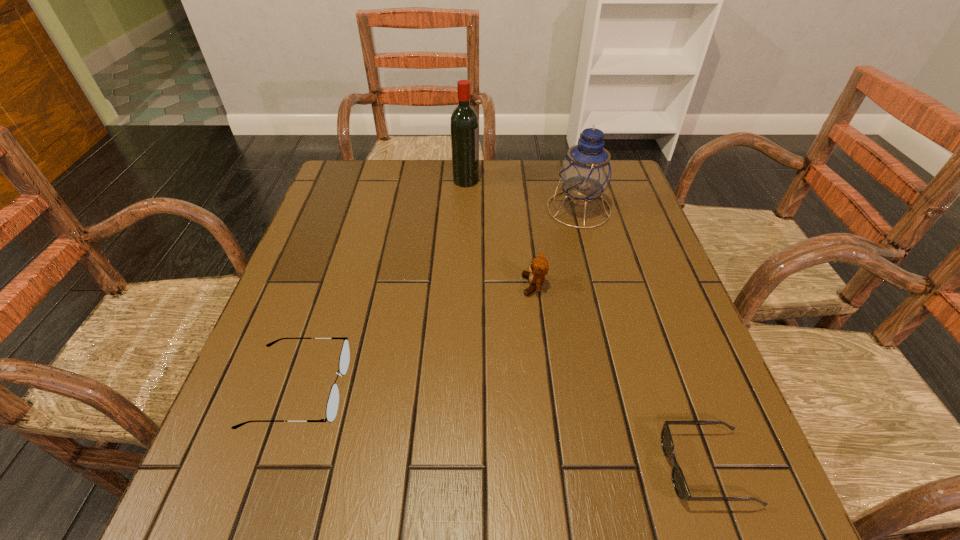
What are the coordinates of `wine bottle` in the screenshot? It's located at (464, 123).

This screenshot has width=960, height=540. I want to click on the farthest object, so click(464, 123).

Find the location of a particular element. The height and width of the screenshot is (540, 960). the second farthest object is located at coordinates (585, 173).

Locate an element on the screen. This screenshot has height=540, width=960. lantern is located at coordinates (585, 173).

The width and height of the screenshot is (960, 540). What are the coordinates of `the third object from right to left` in the screenshot? It's located at point(539,267).

Where is `the third shortest object`? the third shortest object is located at coordinates (539, 267).

Identify the location of spectacles. The image size is (960, 540). pyautogui.click(x=332, y=405).

What are the coordinates of `the fourth tallest object` in the screenshot? It's located at (332, 405).

Identify the location of sunglasses. click(x=680, y=485).

This screenshot has width=960, height=540. I want to click on free space located 0.250m on the label of the second object from left to right, so click(x=563, y=180).